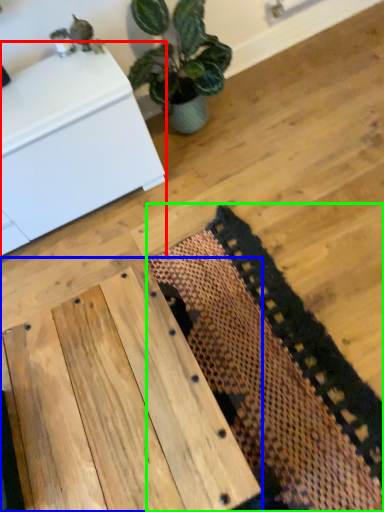
Question: Which is farther away from furniture (highlighted by a red box)? table (highlighted by a blue box) or mat (highlighted by a green box)?

Choices:
 (A) table
 (B) mat

Answer: (A)